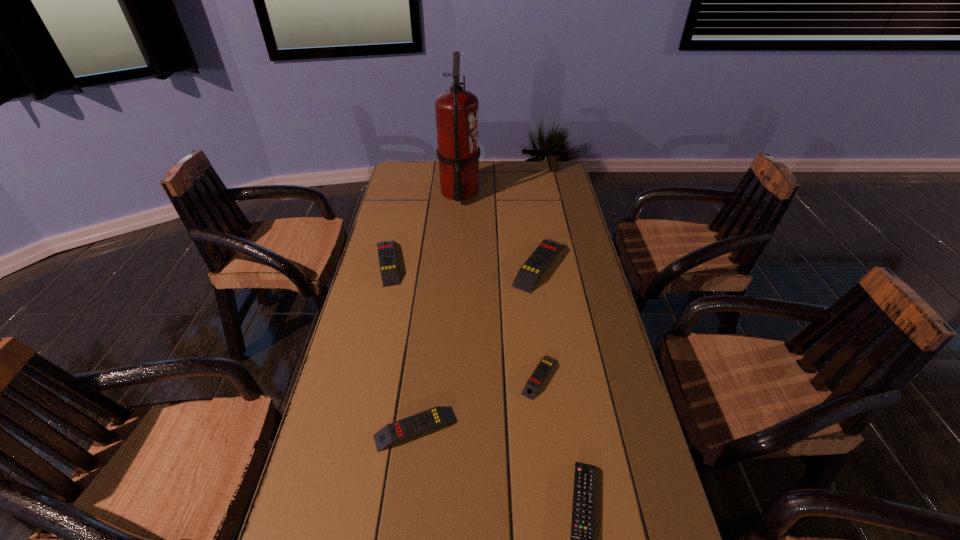
The width and height of the screenshot is (960, 540). In order to click on fire extinguisher located in the far edge section of the desktop in this screenshot , I will do `click(457, 111)`.

The height and width of the screenshot is (540, 960). Find the location of `pistol at the far edge`. pistol at the far edge is located at coordinates (552, 155).

Locate an element on the screen. This screenshot has width=960, height=540. pistol that is at the right edge is located at coordinates (552, 155).

I want to click on remote control that is at the right edge, so click(531, 271).

This screenshot has width=960, height=540. Identify the location of object situated at the far right corner. (552, 155).

Where is `vacant position at the far edge of the desktop`? vacant position at the far edge of the desktop is located at coordinates (521, 182).

In the image, there is a desktop. Identify the location of vacant space at the left edge. (397, 213).

Locate an element on the screen. Image resolution: width=960 pixels, height=540 pixels. vacant space at the right edge of the desktop is located at coordinates click(639, 446).

In the image, there is a desktop. Identify the location of free space at the far right corner. The width and height of the screenshot is (960, 540). (529, 160).

Identify the location of empty location between the tallest object and the third nearest object. This screenshot has height=540, width=960. (500, 284).